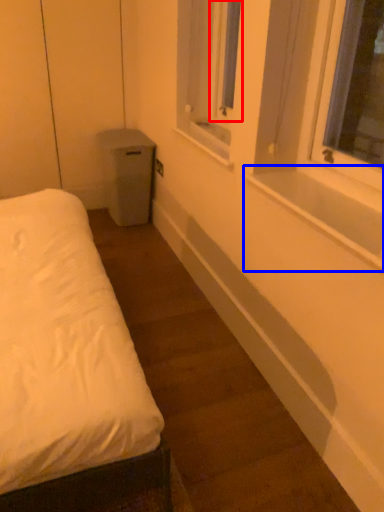
Question: Which point is further to the camera, window screen (highlighted by a red box) or window sill (highlighted by a blue box)?

Choices:
 (A) window screen
 (B) window sill

Answer: (A)